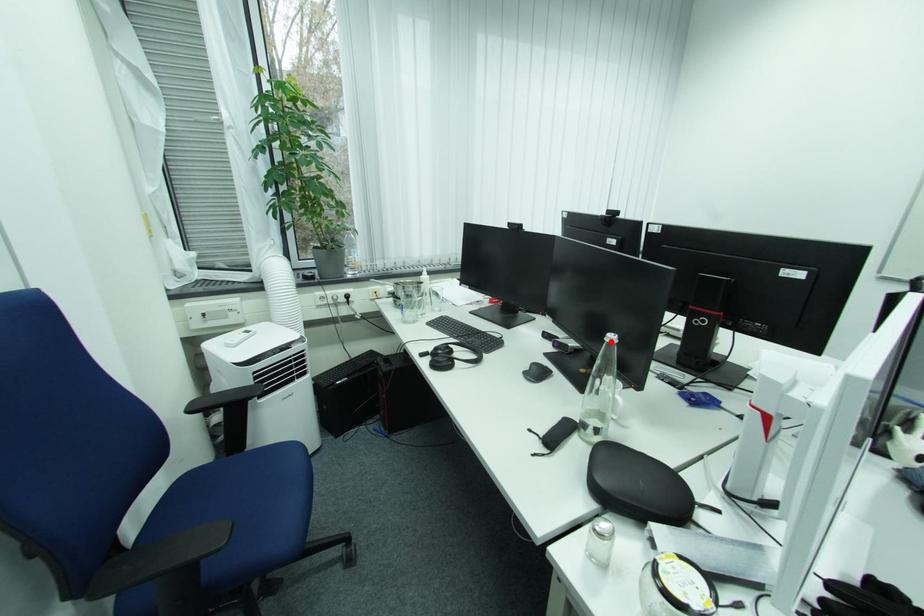
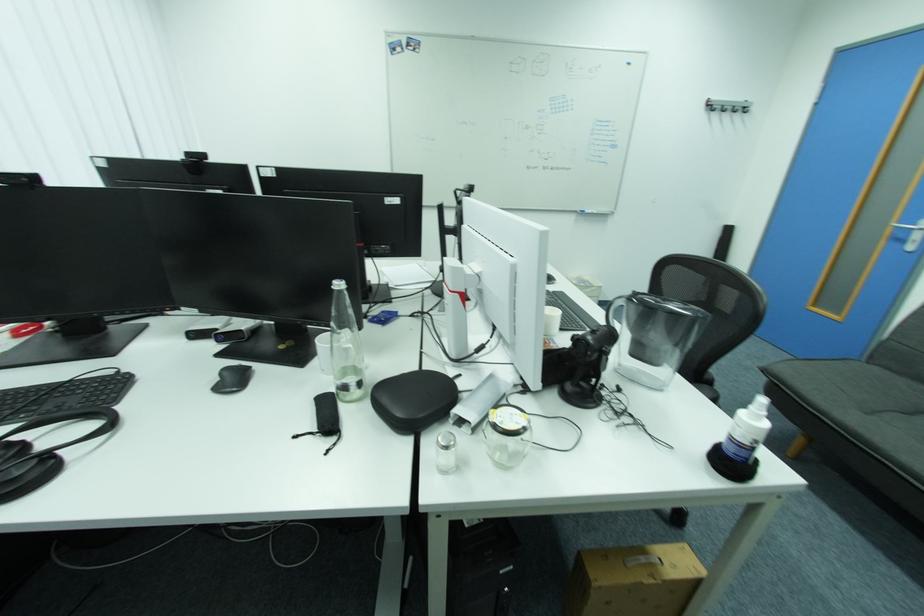
Question: A red point is marked in image1. In image2, is the corresponding 3D point closer to the camera or farther? Reply with the corresponding letter.

Choices:
 (A) The corresponding 3D point is closer.
 (B) The corresponding 3D point is farther.

Answer: (A)